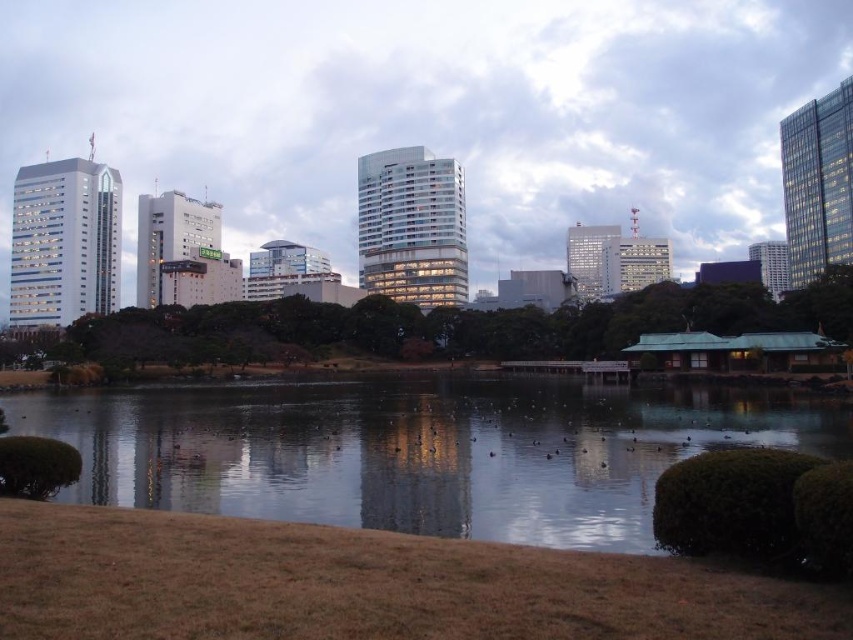
Consider the image. Measure the distance between matte glass buildings at center and clear water at center.

A distance of 657.60 feet exists between matte glass buildings at center and clear water at center.

Who is taller, matte glass buildings at center or clear water at center?

matte glass buildings at center is taller.

The image size is (853, 640). Describe the element at coordinates (426, 113) in the screenshot. I see `matte glass buildings at center` at that location.

Locate an element on the screen. Image resolution: width=853 pixels, height=640 pixels. matte glass buildings at center is located at coordinates (426, 113).